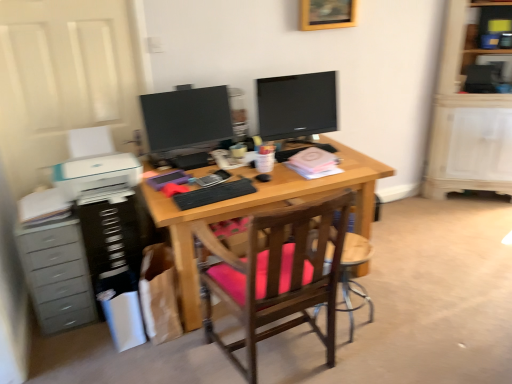
This screenshot has width=512, height=384. Find the location of `unoccupied region to the right of wooden chair at center`. unoccupied region to the right of wooden chair at center is located at coordinates (397, 322).